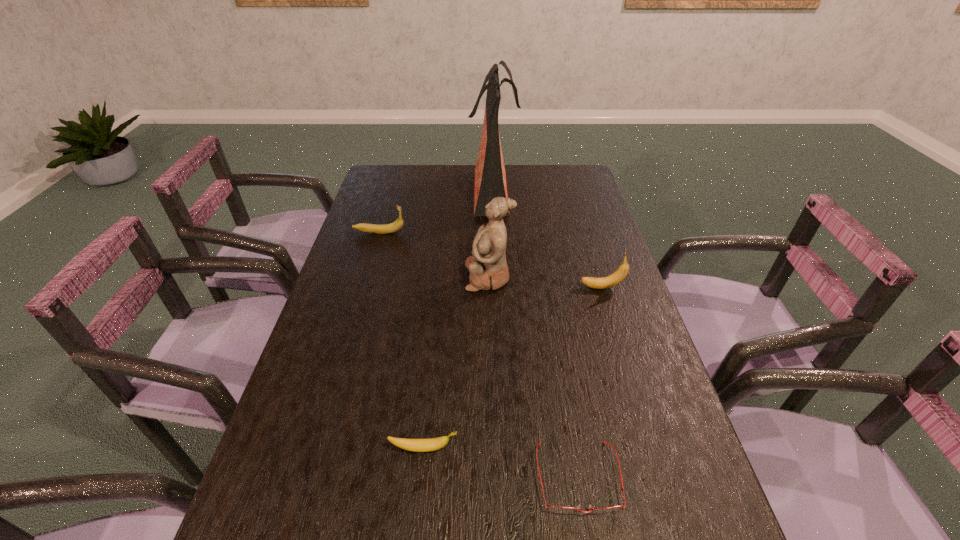
This screenshot has height=540, width=960. I want to click on shopping bag, so click(x=490, y=177).

Where is `the tallest object`? This screenshot has height=540, width=960. the tallest object is located at coordinates (490, 177).

Where is `the fifth shortest object`? The image size is (960, 540). the fifth shortest object is located at coordinates (488, 269).

Where is `the rightmost object`? The image size is (960, 540). the rightmost object is located at coordinates (606, 282).

This screenshot has height=540, width=960. Find the location of `the rightmost banana`. the rightmost banana is located at coordinates 606,282.

The height and width of the screenshot is (540, 960). I want to click on the leftmost banana, so click(x=398, y=224).

The width and height of the screenshot is (960, 540). I want to click on the fifth nearest object, so click(x=398, y=224).

Locate an element on the screen. the second banana from left to right is located at coordinates (416, 445).

The height and width of the screenshot is (540, 960). What are the coordinates of `the shortest banana` in the screenshot? It's located at (416, 445).

The width and height of the screenshot is (960, 540). Identify the location of spectacles. (557, 509).